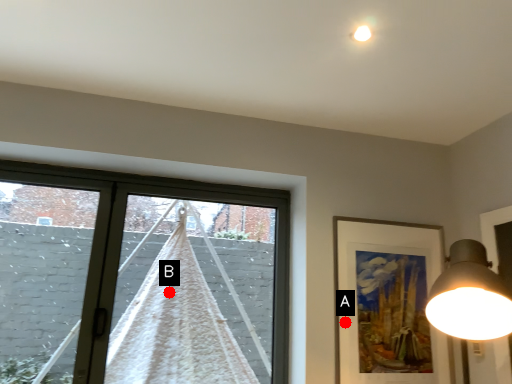
Question: Two points are circled on the image, labeled by A and B beside each circle. Which of the following is the closest to the observer?

Choices:
 (A) A is closer
 (B) B is closer

Answer: (A)